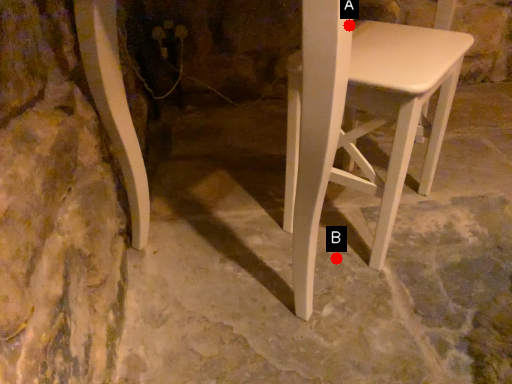
Question: Two points are circled on the image, labeled by A and B beside each circle. Among these points, which one is farthest from the camera?

Choices:
 (A) A is further
 (B) B is further

Answer: (B)